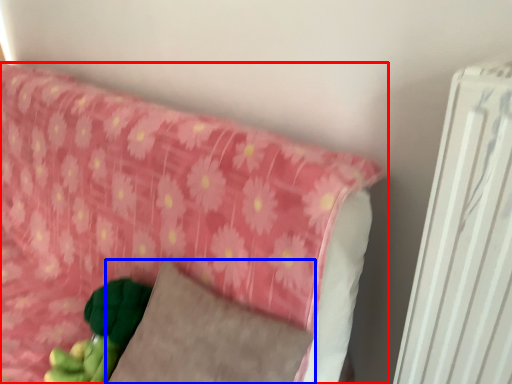
Question: Which of the following is the farthest to the observer, furniture (highlighted by a red box) or pillow (highlighted by a blue box)?

Choices:
 (A) furniture
 (B) pillow

Answer: (B)